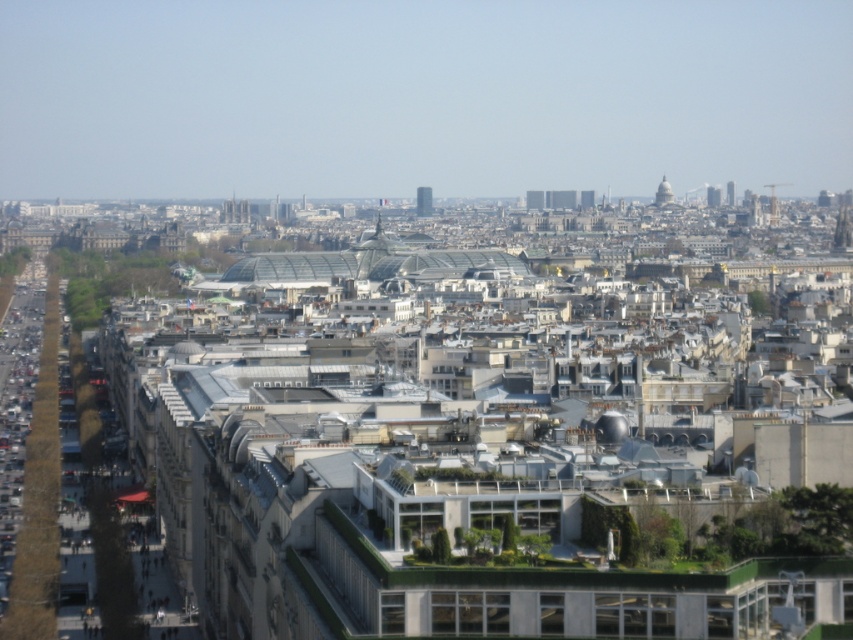
You are a drone operator planning to fly a drone from the green glass tower at center to the smooth glass spire at upper center. Based on the scene description, can you determine if the drone will have a clear path without needing to go around any obstacles?

The smooth glass spire at upper center is behind the green glass tower at center, so the drone would need to navigate around the green glass tower at center to reach the smooth glass spire at upper center, meaning there isn not a direct clear path.

Consider the image. You are standing at the center of the city square and see two points marked in the image. The first point is labeled as point (416,212) and the second is point (711,193). Which point is closer to you?

Point (416,212) is in front of point (711,193), so it is closer to you.